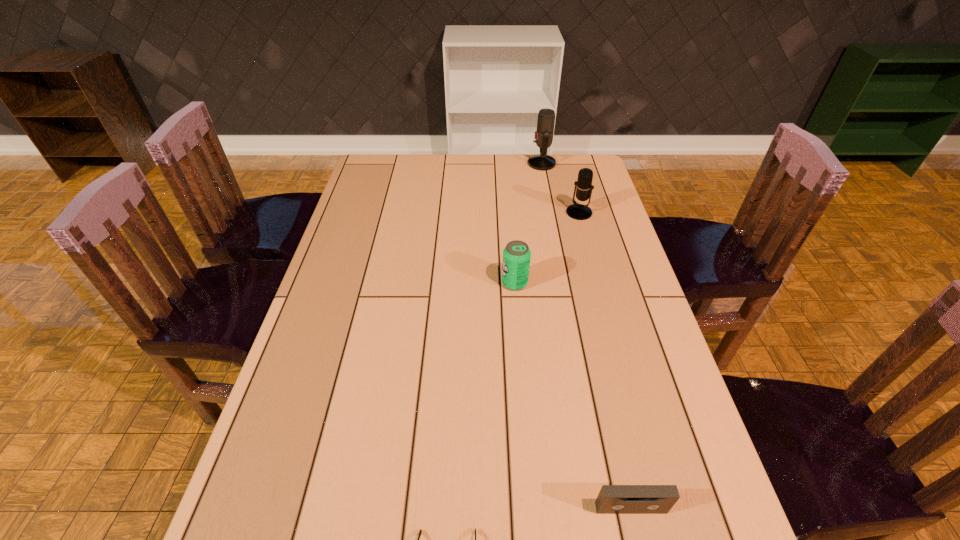
The width and height of the screenshot is (960, 540). In the image, there is a desktop. Find the location of `vacant space at the right edge`. vacant space at the right edge is located at coordinates (640, 375).

In the image, there is a desktop. Identify the location of free space at the far left corner. This screenshot has height=540, width=960. (398, 180).

Where is `free point between the pop soda and the farthest object`? free point between the pop soda and the farthest object is located at coordinates (528, 223).

Where is `vacant space that is in between the second farthest object and the fourth object from right to left`? The image size is (960, 540). vacant space that is in between the second farthest object and the fourth object from right to left is located at coordinates (547, 248).

In order to click on free space between the tallest object and the second nearest object in this screenshot , I will do `click(587, 336)`.

Locate an element on the screen. This screenshot has height=540, width=960. free point between the nearer microphone and the farthest object is located at coordinates (561, 188).

Locate an element on the screen. The image size is (960, 540). vacant area between the second nearest object and the shorter microphone is located at coordinates (605, 360).

Select which object appears as the fourth closest to the sunglasses. Please provide its 2D coordinates. Your answer should be formatted as a tuple, i.e. [(x, y)], where the tuple contains the x and y coordinates of a point satisfying the conditions above.

[(546, 117)]

Identify which object is the fourth closest to the nearer microphone. Please provide its 2D coordinates. Your answer should be formatted as a tuple, i.e. [(x, y)], where the tuple contains the x and y coordinates of a point satisfying the conditions above.

[(420, 532)]

You are a GUI agent. You are given a task and a screenshot of the screen. Output one action in this format:
    pyautogui.click(x=<x>, y=<y>)
    Task: Click on the free space that satisfies the following two spatial constraints: 1. on the back side of the second tallest object; 2. on the side of the farther microphone with the red ring
    
    Given the screenshot: What is the action you would take?
    pyautogui.click(x=565, y=164)